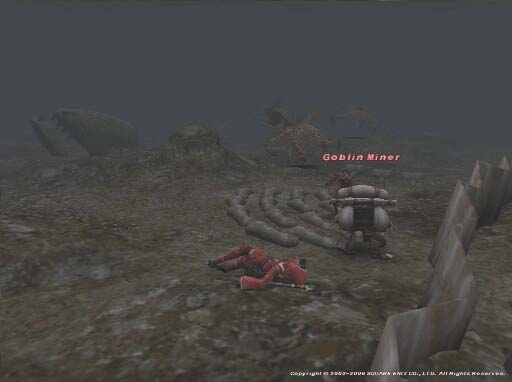
This screenshot has width=512, height=382. What are the coordinates of `wall` in the screenshot? It's located at (443, 251).